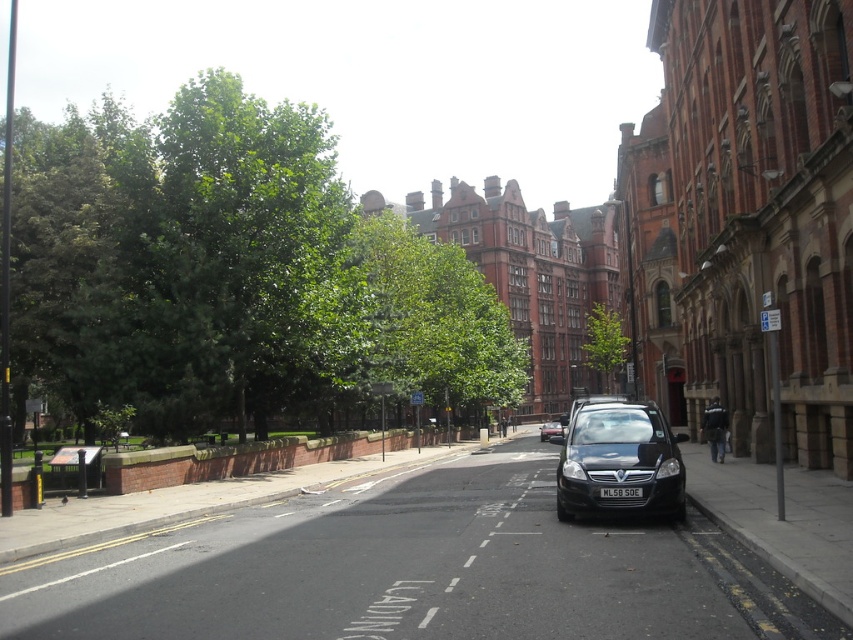
Question: Can you confirm if green leafy tree at upper left is wider than white plastic license plate at center?

Choices:
 (A) yes
 (B) no

Answer: (A)

Question: Which of the following is the farthest from the observer?

Choices:
 (A) (605, 316)
 (B) (618, 445)

Answer: (A)

Question: Which of the following is the closest to the observer?

Choices:
 (A) shiny black car at center
 (B) white plastic license plate at center

Answer: (B)

Question: Considering the real-world distances, which object is closest to the green leafy tree at upper left?

Choices:
 (A) shiny black car at center
 (B) black glossy car at center
 (C) white plastic license plate at center

Answer: (A)

Question: Is green leafy tree at upper left bigger than green leafy tree at center?

Choices:
 (A) no
 (B) yes

Answer: (B)

Question: Does green leafy tree at center appear on the right side of black glossy car at center?

Choices:
 (A) yes
 (B) no

Answer: (A)